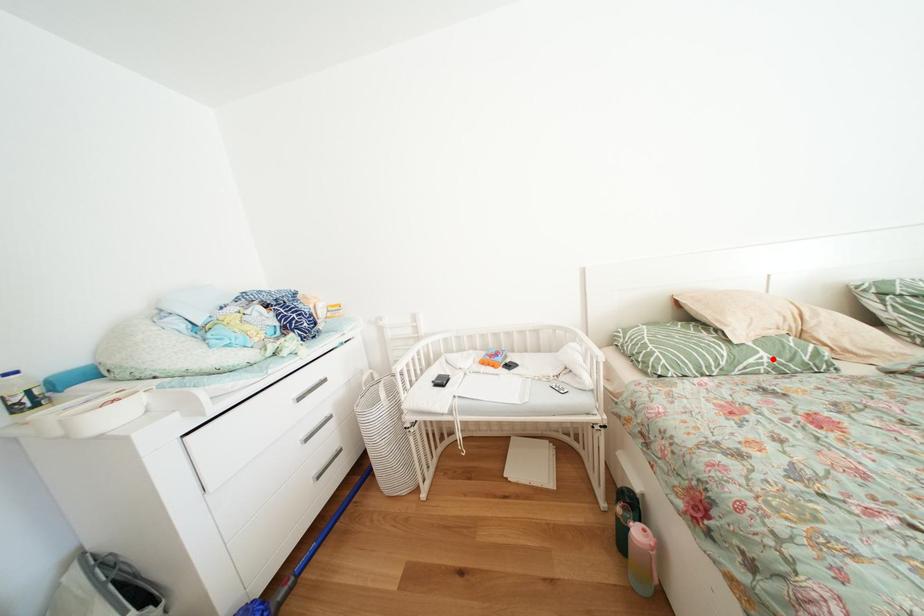
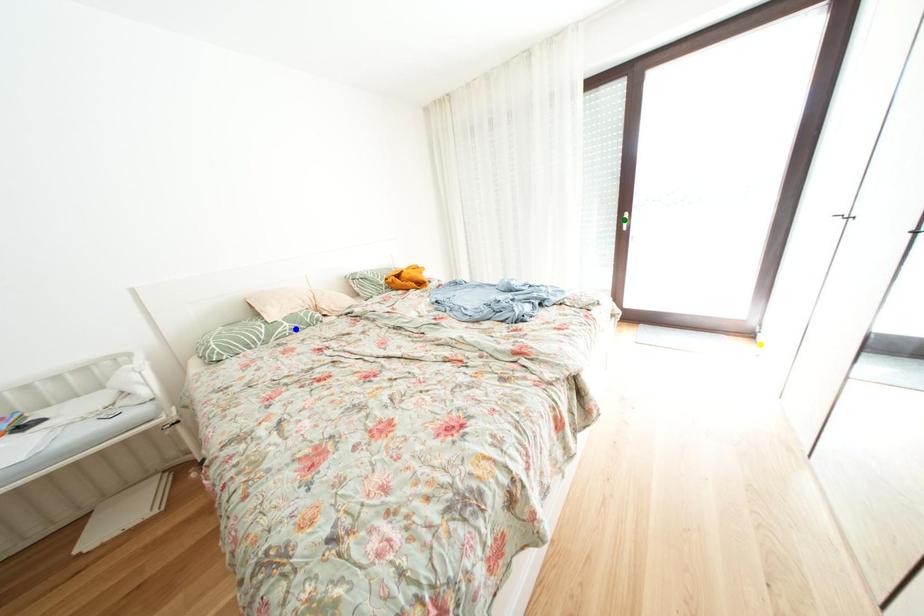
Question: I am providing you with two images of the same scene from different viewpoints. A red point is marked on the first image. You are given multiple points on the second image. Can you choose the point in image 2 that corresponds to the point in image 1?

Choices:
 (A) blue point
 (B) green point
 (C) yellow point

Answer: (A)